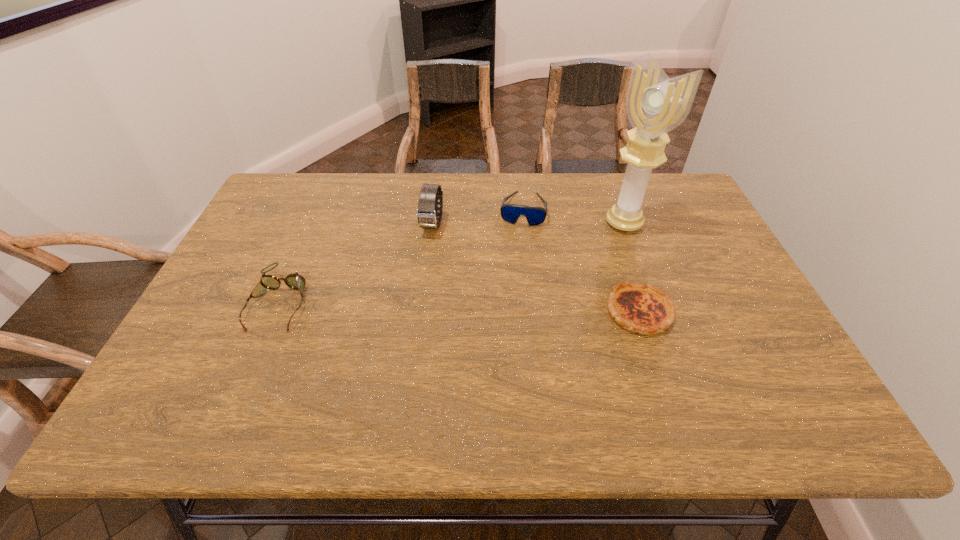
Identify the location of the leftmost object. (295, 281).

You are a GUI agent. You are given a task and a screenshot of the screen. Output one action in this format:
    pyautogui.click(x=<x>, y=<y>)
    Task: Click on the spectacles
    The image size is (960, 540).
    Given the screenshot: What is the action you would take?
    click(x=295, y=281)

Find the location of `quiche`. quiche is located at coordinates (643, 308).

Where is `the second tallest object`? The height and width of the screenshot is (540, 960). the second tallest object is located at coordinates (427, 212).

Where is `the fourth object from right to left`? Image resolution: width=960 pixels, height=540 pixels. the fourth object from right to left is located at coordinates (427, 212).

This screenshot has width=960, height=540. What are the coordinates of `the tallest object` in the screenshot? It's located at (655, 104).

Locate an element on the screen. the third tallest object is located at coordinates (535, 215).

The width and height of the screenshot is (960, 540). Find the location of `sunglasses`. sunglasses is located at coordinates (535, 215).

At what (x,y) coordinates should I click in order to perform the action: click on vacant space situated on the front-facing side of the second shortest object. Please return your answer as a coordinate pair (x, y). This screenshot has width=960, height=540. Looking at the image, I should click on tap(250, 373).

The height and width of the screenshot is (540, 960). What are the coordinates of `free spot located 0.110m on the left of the quiche` in the screenshot? It's located at (562, 312).